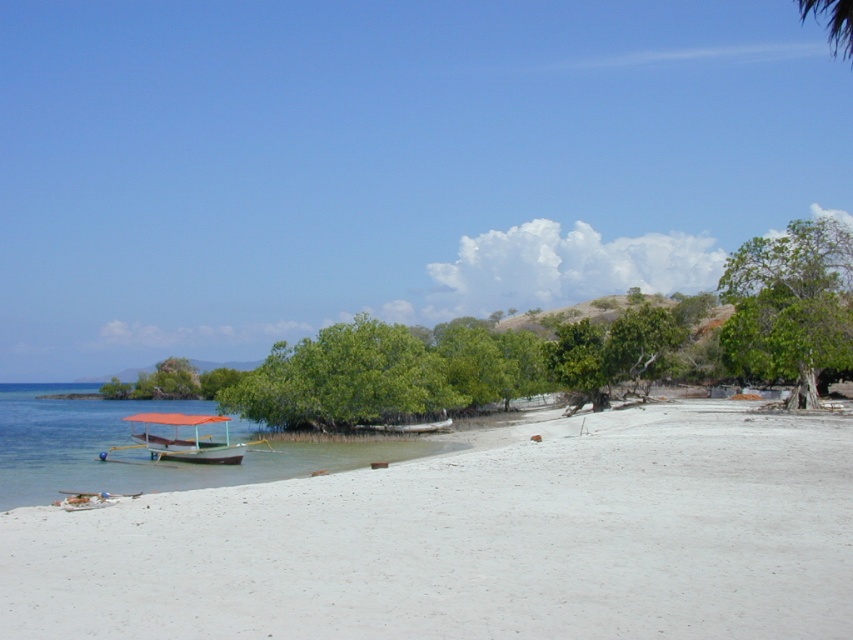
You are standing on the beach and want to take a photo of the orange fabric boat at lower left and the green leafy tree at center. Which object should you focus on first if you want both to be in clear focus?

You should focus on the orange fabric boat at lower left first because it is closer to you than the green leafy tree at center. By focusing on the closer object, the tree will also be in focus due to the depth of field.

You are a delivery drone that needs to fly from the green leafy tree at center to the white matte boat at center. The drone has a maximum flight range of 70 meters. Can it make the trip without needing to recharge?

The distance between the green leafy tree at center and the white matte boat at center is 68.74 meters, which is within the drone